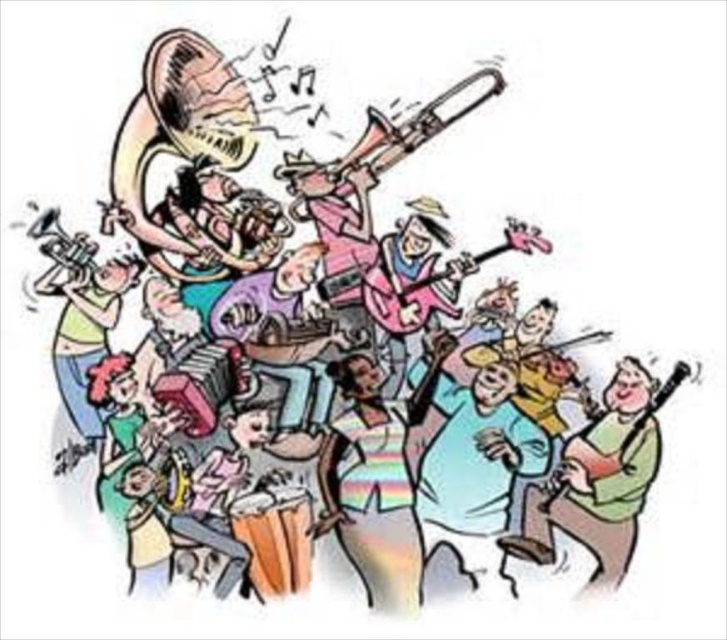
You are a music enthusiast standing in front of the band. You notice the metallic brass trumpet at upper center and the pink matte guitar at center. Which instrument is positioned higher in the image?

The metallic brass trumpet at upper center is positioned higher than the pink matte guitar at center.

Based on the photo, you are a music enthusiast standing in front of the band. You notice a point at coordinates (385, 141). What instrument is located at that point?

The metallic brass trumpet at upper center is located at point (385, 141).

You are a sound engineer setting up microphones for the band. The metallic brass trumpet at upper center and the pink matte guitar at center are both on the same stage. You have a microphone cable that is 5.5 inches long. Can you connect both instruments with this cable without extending it?

The distance between the metallic brass trumpet at upper center and the pink matte guitar at center is 5.58 inches. The cable is only 5.5 inches long, which is shorter than the required distance. Therefore, the cable cannot reach both instruments without extension.